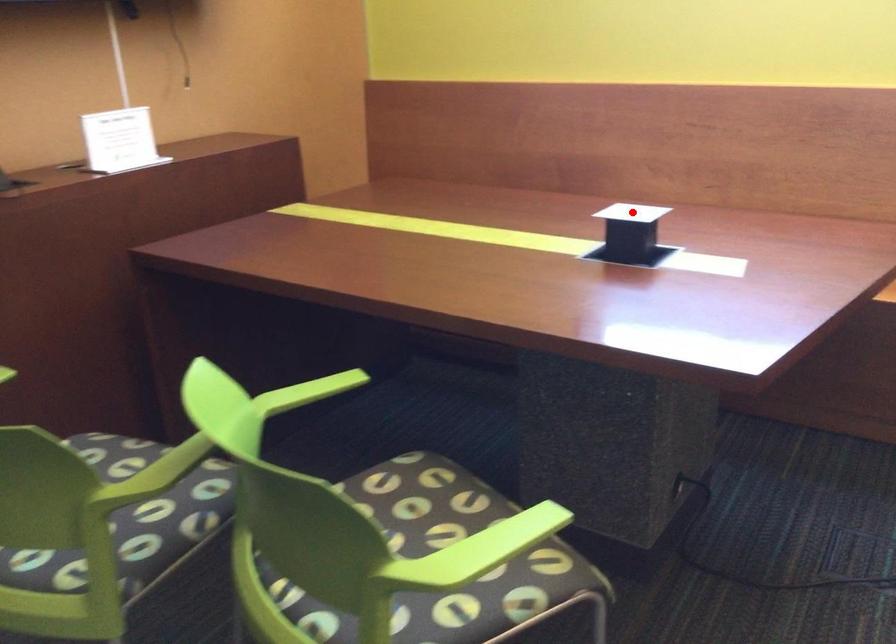
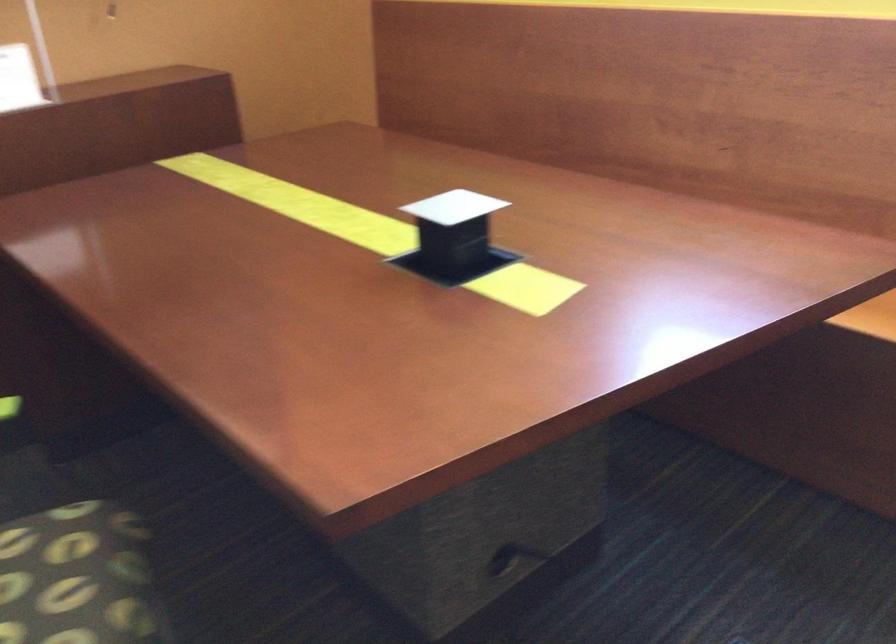
Locate, in the second image, the point that corresponds to the highlighted location in the first image.

(453, 207)